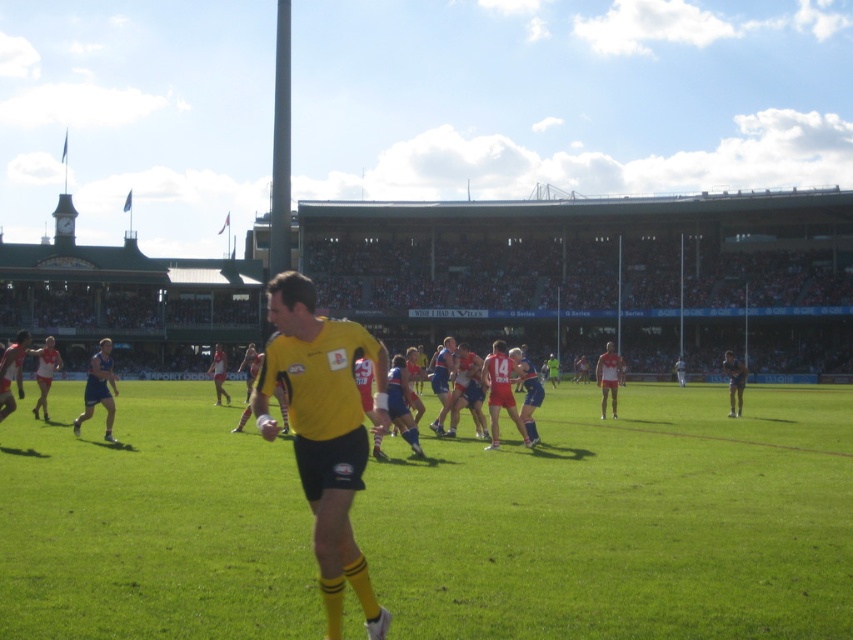
In the scene shown: You are a spectator at the rugby match and want to identify the referee. Based on the players in yellow jersey at center and blue uniform at center, which one is likely the referee?

The referee is the one wearing the yellow jersey at center, as the yellow jersey at center has a larger size compared to the blue uniform at center, which is typical for referees in rugby matches.

You are a spectator at the rugby match and want to take a photo of both the yellow jersey at center and the blue uniform at center. Which player should you zoom in on to capture a larger portion of the player in your photo?

The yellow jersey at center has a greater width than the blue uniform at center, so zooming in on the yellow jersey at center will allow you to capture a larger portion of the player in your photo.